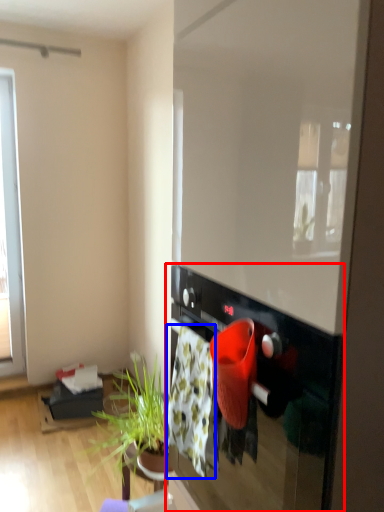
Question: Which object is further to the camera taking this photo, oven (highlighted by a red box) or blanket (highlighted by a blue box)?

Choices:
 (A) oven
 (B) blanket

Answer: (B)